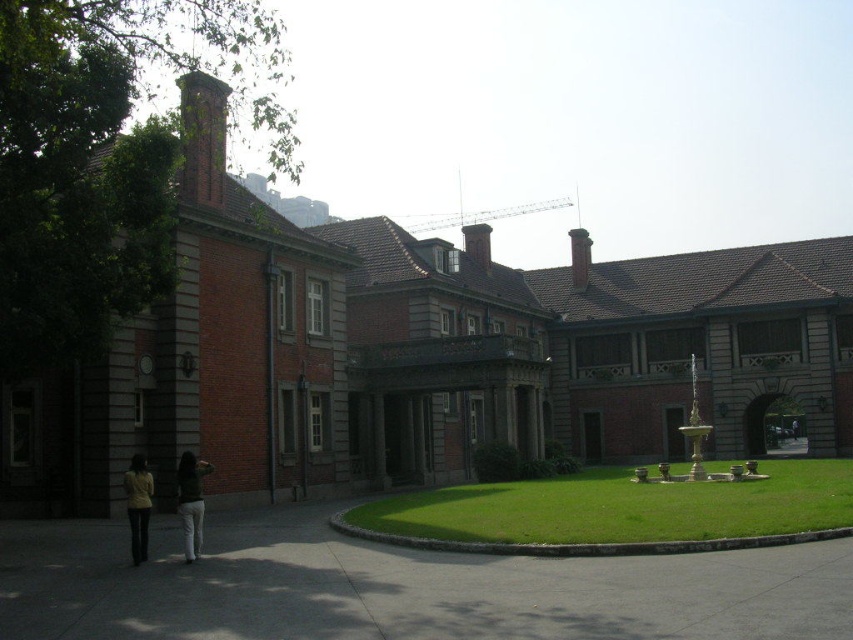
Consider the image. You are standing on the lawn and want to place a dark green sweater at center. Is there enough space on the green grass at center to place it without overlapping?

The green grass at center might be wider than dark green sweater at center, so there is likely enough space to place the sweater without overlapping.

You are standing on the lawn in front of the historic building and see the green grass at center and the yellow fabric jacket at lower left. Which object is closer to the ground?

The green grass at center is closer to the ground because it is located below the yellow fabric jacket at lower left.

You are standing at the entrance of the historic building and want to reach the green grass at center. Which direction should you walk to get there?

Walk towards the center of the lawn to reach the green grass at center.